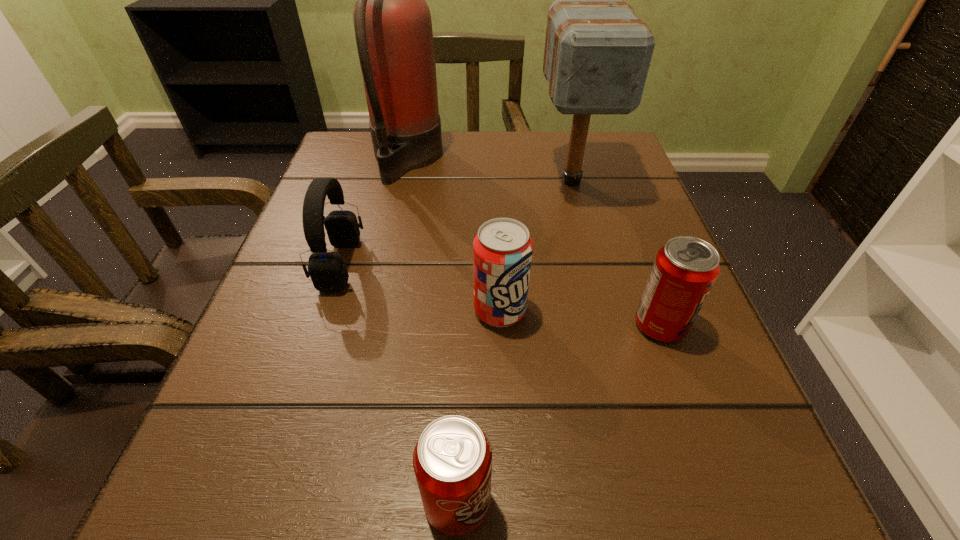
The width and height of the screenshot is (960, 540). What are the coordinates of `the tallest object` in the screenshot? It's located at (392, 21).

Where is `the second tallest object`? the second tallest object is located at coordinates (597, 54).

Where is `headset`? The image size is (960, 540). headset is located at coordinates [x=328, y=272].

This screenshot has height=540, width=960. What are the coordinates of `the rightmost soda` in the screenshot? It's located at (685, 269).

Where is `vacant space located 0.150m at the nozzle of the fire extinguisher`? The image size is (960, 540). vacant space located 0.150m at the nozzle of the fire extinguisher is located at coordinates (510, 159).

In order to click on free location located on the striking surface of the mallet in this screenshot , I will do `click(597, 278)`.

You are a GUI agent. You are given a task and a screenshot of the screen. Output one action in this format:
    pyautogui.click(x=<x>, y=<y>)
    Task: Click on the free location located on the headband of the headset
    This screenshot has width=960, height=540.
    Given the screenshot: What is the action you would take?
    pyautogui.click(x=462, y=264)

In order to click on vacant space located on the left of the rightmost soda in this screenshot , I will do `click(415, 325)`.

Where is `fire extinguisher at the far edge`? The height and width of the screenshot is (540, 960). fire extinguisher at the far edge is located at coordinates (392, 21).

The width and height of the screenshot is (960, 540). Identify the location of mallet that is at the far edge. (597, 54).